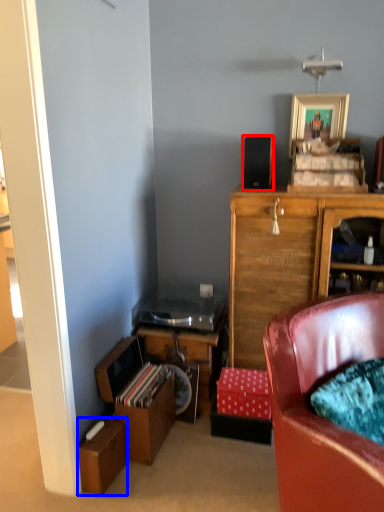
Question: Which object appears closest to the camera in this image, loudspeaker (highlighted by a red box) or cardboard box (highlighted by a blue box)?

Choices:
 (A) loudspeaker
 (B) cardboard box

Answer: (B)